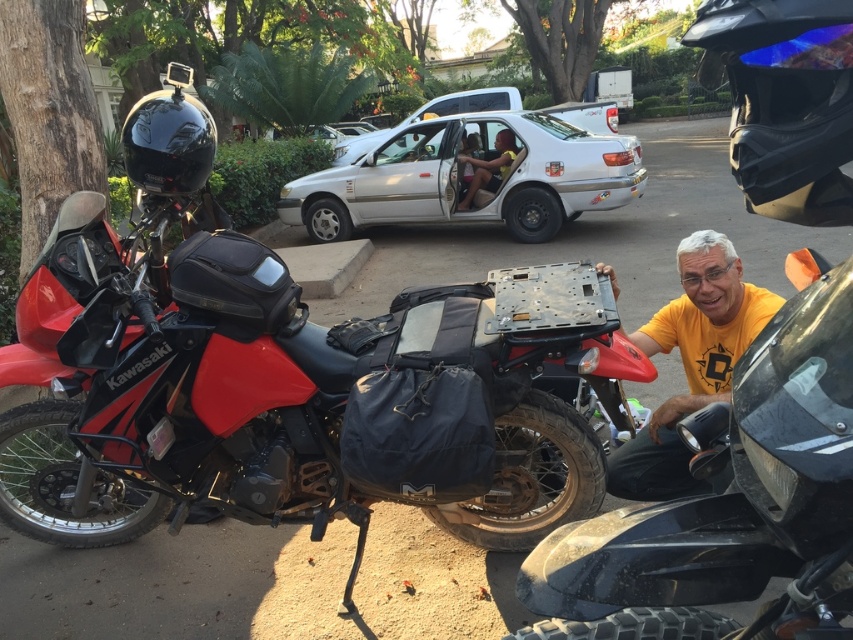
Does yellow matte shirt at center appear on the right side of black glossy helmet at upper left?

Yes, yellow matte shirt at center is to the right of black glossy helmet at upper left.

Does point (706, 307) come behind point (181, 150)?

Yes.

The width and height of the screenshot is (853, 640). In order to click on yellow matte shirt at center in this screenshot , I will do `click(689, 362)`.

Which of these two, silver metallic car at center or matte black helmet at upper left, stands taller?

With more height is silver metallic car at center.

Who is higher up, silver metallic car at center or matte black helmet at upper left?

matte black helmet at upper left

Does point (473, 216) come in front of point (471, 196)?

Yes.

Identify the location of silver metallic car at center. Image resolution: width=853 pixels, height=640 pixels. tap(466, 177).

Is black matte helmet at upper right below yellow matte shirt at center?

No.

Does black matte helmet at upper right have a greater height compared to yellow matte shirt at center?

Incorrect, black matte helmet at upper right's height is not larger of yellow matte shirt at center's.

Between point (828, 4) and point (776, 296), which one is positioned behind?

The point (776, 296) is more distant.

I want to click on black matte helmet at upper right, so click(x=784, y=100).